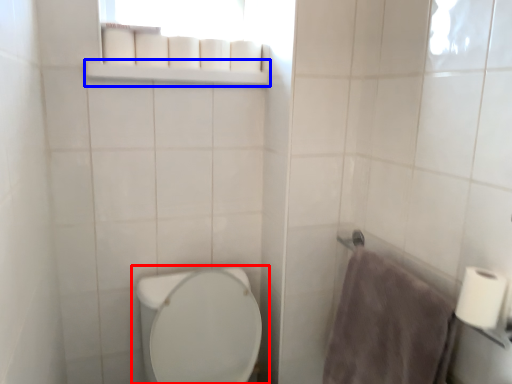
Question: Which of the following is the closest to the observer, toilet (highlighted by a red box) or balustrade (highlighted by a blue box)?

Choices:
 (A) toilet
 (B) balustrade

Answer: (A)